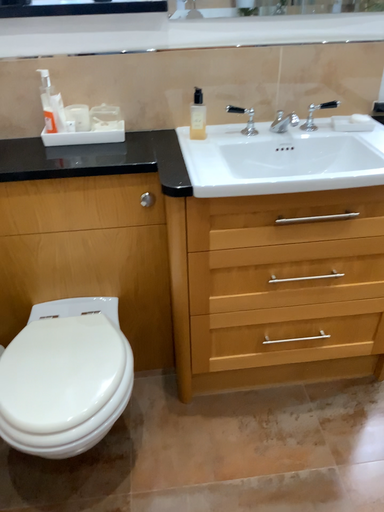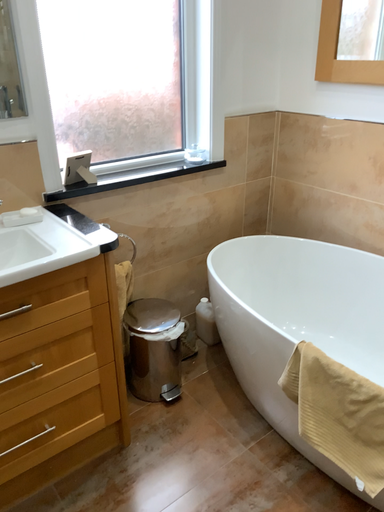
Question: How did the camera likely rotate when shooting the video?

Choices:
 (A) rotated left
 (B) rotated right

Answer: (B)